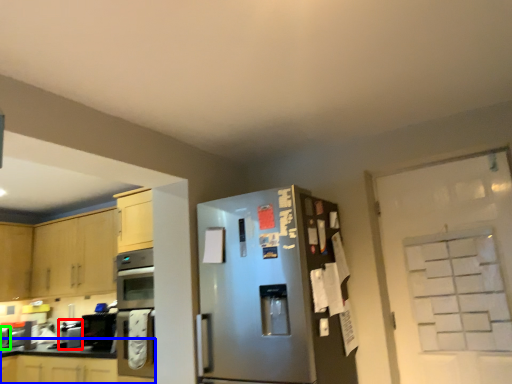
Question: Which object is the farthest from appliance (highlighted by a red box)? Choose among these: cabinetry (highlighted by a blue box) or appliance (highlighted by a green box).

Choices:
 (A) cabinetry
 (B) appliance

Answer: (B)